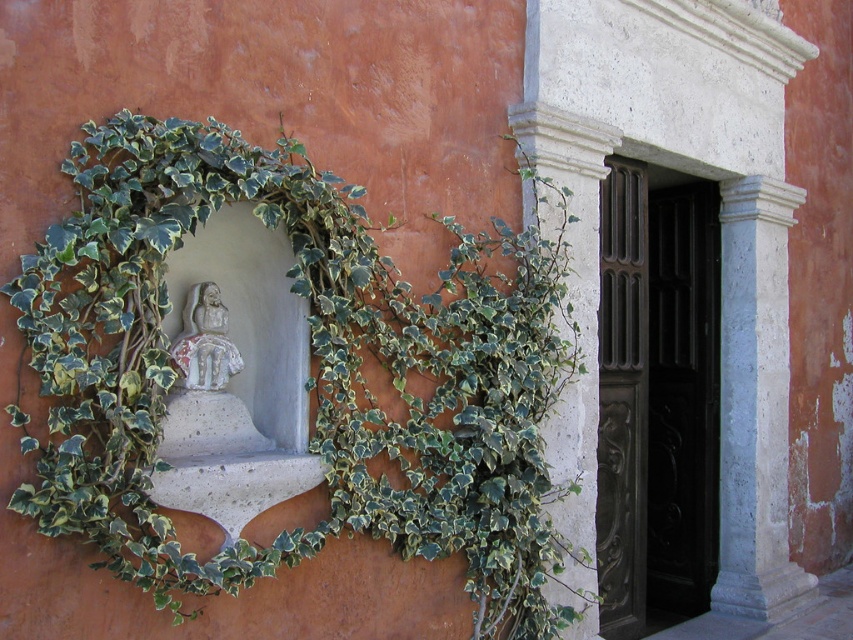
Is green leafy ivy at left behind white stone pillar at right?

No, it is not.

What do you see at coordinates (306, 378) in the screenshot? I see `green leafy ivy at left` at bounding box center [306, 378].

Identify the location of green leafy ivy at left. This screenshot has width=853, height=640. [306, 378].